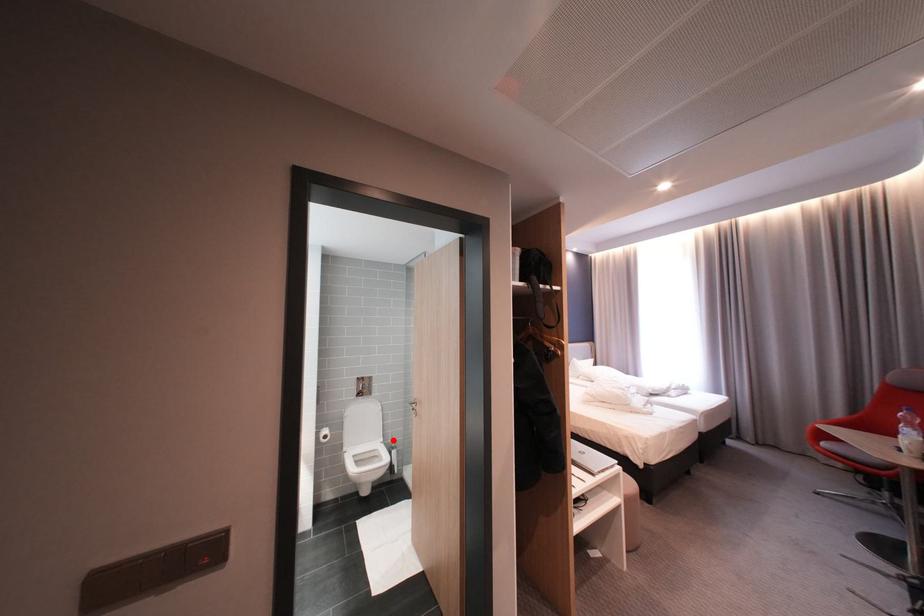
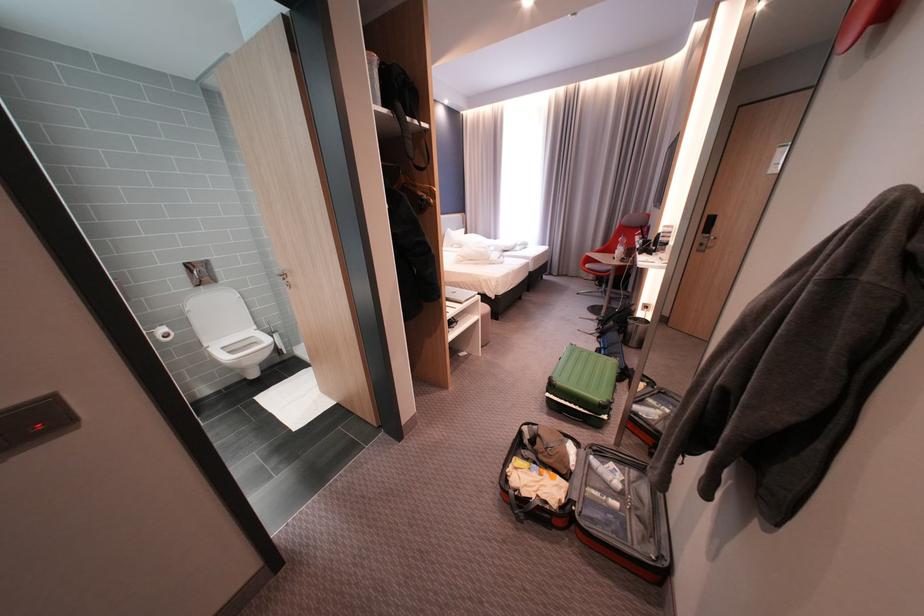
Question: I am providing you with two images of the same scene from different viewpoints. A red point is shown in image1. For the corresponding object point in image2, is it positioned nearer or farther from the camera?

Choices:
 (A) Nearer
 (B) Farther

Answer: (A)